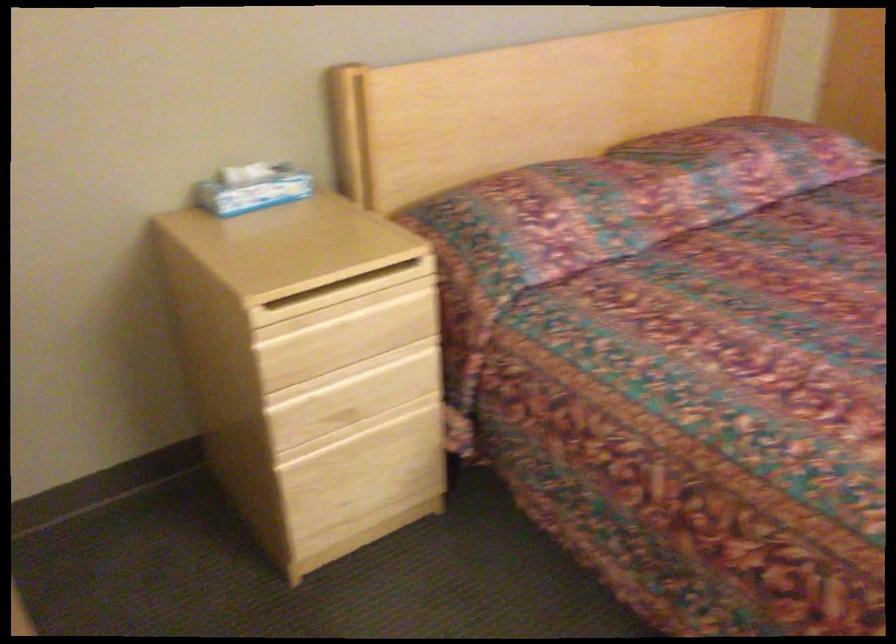
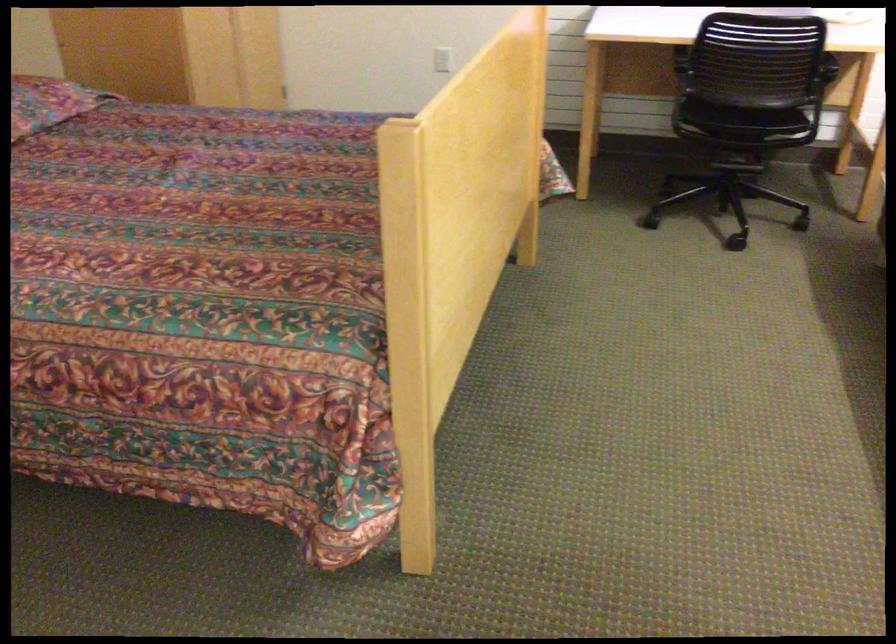
Question: The camera is either moving clockwise (left) or counter-clockwise (right) around the object. The first image is from the beginning of the video and the second image is from the end. Is the camera moving left or right when shooting the video?

Choices:
 (A) Left
 (B) Right

Answer: (A)